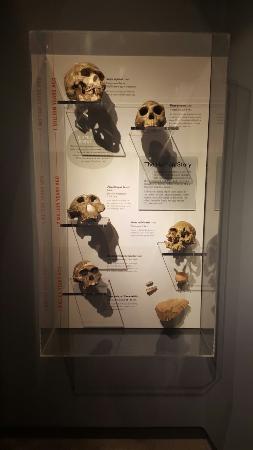
You are a GUI agent. You are given a task and a screenshot of the screen. Output one action in this format:
    pyautogui.click(x=<x>, y=<y>)
    Task: Click on the wall
    This screenshot has width=253, height=450.
    Given the screenshot: What is the action you would take?
    pyautogui.click(x=242, y=334)